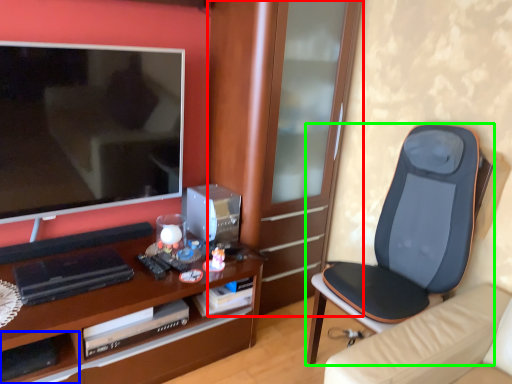
Question: Based on their relative distances, which object is nearer to cabinetry (highlighted by a red box)? Choose from shelf (highlighted by a blue box) and chair (highlighted by a green box).

Choices:
 (A) shelf
 (B) chair

Answer: (B)